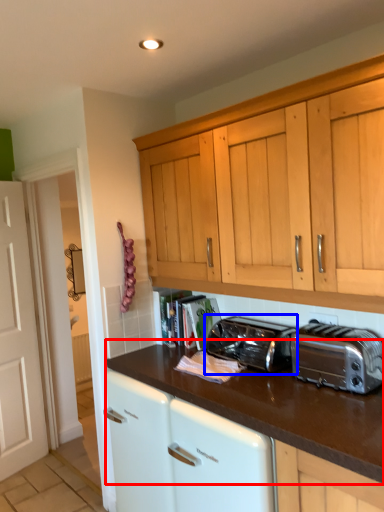
Question: Which object is closer to the camera taking this photo, countertop (highlighted by a red box) or toaster (highlighted by a blue box)?

Choices:
 (A) countertop
 (B) toaster

Answer: (A)